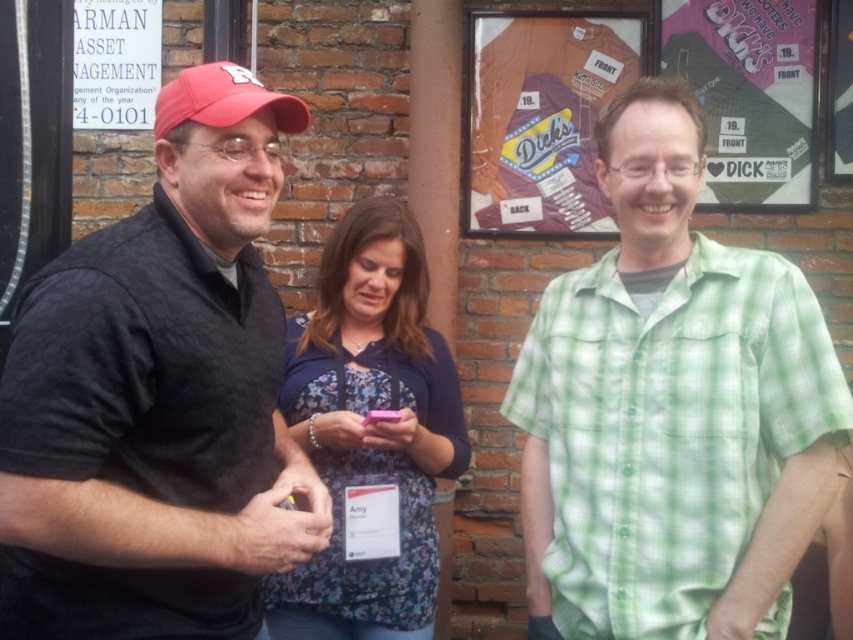
Question: Which point is farther from the camera taking this photo?

Choices:
 (A) click(x=637, y=548)
 (B) click(x=367, y=412)

Answer: (B)

Question: Is floral fabric shirt at center below red matte baseball cap at upper left?

Choices:
 (A) no
 (B) yes

Answer: (B)

Question: Can you confirm if black textured shirt at left is wider than floral fabric shirt at center?

Choices:
 (A) no
 (B) yes

Answer: (B)

Question: Estimate the real-world distances between objects in this image. Which object is farther from the black textured shirt at left?

Choices:
 (A) floral fabric shirt at center
 (B) pink plastic phone at center

Answer: (B)

Question: Is green checkered shirt at center to the left of pink plastic phone at center from the viewer's perspective?

Choices:
 (A) no
 (B) yes

Answer: (A)

Question: Which object appears closest to the camera in this image?

Choices:
 (A) green checkered shirt at center
 (B) floral fabric shirt at center

Answer: (A)